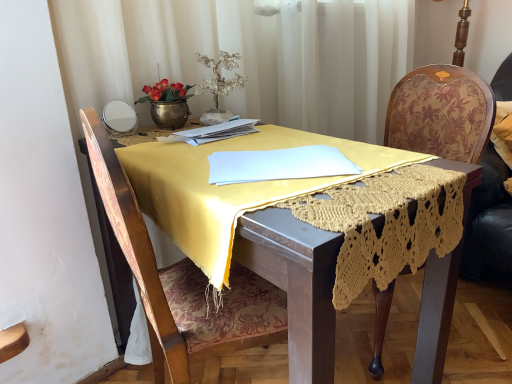
Question: Does velvet floral swivel chair at right have a lesser height compared to wooden floral-patterned chair at right, placed as the second chair when sorted from left to right?

Choices:
 (A) yes
 (B) no

Answer: (A)

Question: Does velvet floral swivel chair at right come in front of wooden floral-patterned chair at right, marked as the 1th chair in a right-to-left arrangement?

Choices:
 (A) no
 (B) yes

Answer: (A)

Question: From the image's perspective, is velvet floral swivel chair at right beneath wooden floral-patterned chair at right, placed as the second chair when sorted from left to right?

Choices:
 (A) no
 (B) yes

Answer: (A)

Question: Is velvet floral swivel chair at right in contact with wooden floral-patterned chair at right, placed as the second chair when sorted from left to right?

Choices:
 (A) no
 (B) yes

Answer: (A)

Question: Does velvet floral swivel chair at right have a lesser width compared to wooden floral-patterned chair at right, marked as the 1th chair in a right-to-left arrangement?

Choices:
 (A) no
 (B) yes

Answer: (B)

Question: From a real-world perspective, is wooden floral-patterned chair at right, marked as the 1th chair in a right-to-left arrangement, positioned above or below velvet floral swivel chair at right?

Choices:
 (A) above
 (B) below

Answer: (B)

Question: Considering the positions of point (476, 170) and point (475, 195), is point (476, 170) closer or farther from the camera than point (475, 195)?

Choices:
 (A) closer
 (B) farther

Answer: (A)

Question: Considering the positions of wooden floral-patterned chair at right, marked as the 1th chair in a right-to-left arrangement, and velvet floral swivel chair at right in the image, is wooden floral-patterned chair at right, marked as the 1th chair in a right-to-left arrangement, taller or shorter than velvet floral swivel chair at right?

Choices:
 (A) tall
 (B) short

Answer: (A)

Question: Based on their sizes in the image, would you say wooden floral-patterned chair at right, marked as the 1th chair in a right-to-left arrangement, is bigger or smaller than velvet floral swivel chair at right?

Choices:
 (A) small
 (B) big

Answer: (B)

Question: In terms of size, does yellow fabric table at center appear bigger or smaller than wooden floral-patterned chair at right, placed as the second chair when sorted from left to right?

Choices:
 (A) big
 (B) small

Answer: (A)

Question: Considering the relative positions of yellow fabric table at center and wooden floral-patterned chair at right, marked as the 1th chair in a right-to-left arrangement, in the image provided, is yellow fabric table at center to the left or to the right of wooden floral-patterned chair at right, marked as the 1th chair in a right-to-left arrangement,?

Choices:
 (A) right
 (B) left

Answer: (B)

Question: In terms of height, does yellow fabric table at center look taller or shorter compared to wooden floral-patterned chair at right, marked as the 1th chair in a right-to-left arrangement?

Choices:
 (A) short
 (B) tall

Answer: (A)

Question: From a real-world perspective, relative to wooden floral-patterned chair at right, marked as the 1th chair in a right-to-left arrangement, is yellow fabric table at center vertically above or below?

Choices:
 (A) below
 (B) above

Answer: (A)

Question: From the image's perspective, relative to velvet floral swivel chair at right, is yellow fabric table at center above or below?

Choices:
 (A) below
 (B) above

Answer: (A)

Question: Based on their sizes in the image, would you say yellow fabric table at center is bigger or smaller than velvet floral swivel chair at right?

Choices:
 (A) small
 (B) big

Answer: (B)